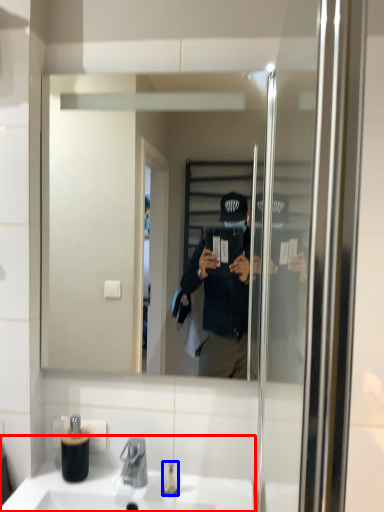
Question: Which point is further to the camera, sink (highlighted by a red box) or toiletry (highlighted by a blue box)?

Choices:
 (A) sink
 (B) toiletry

Answer: (B)